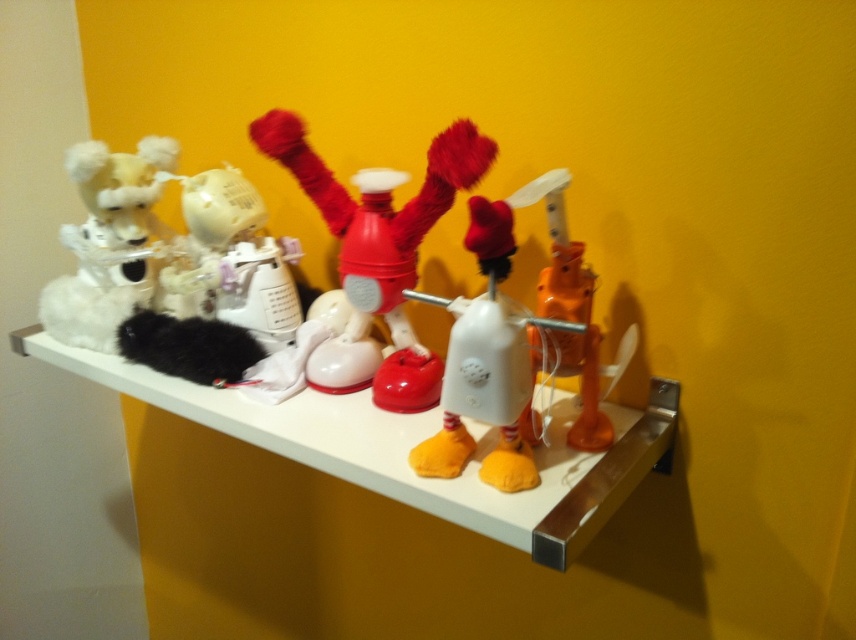
Question: Which of the following is the closest to the observer?

Choices:
 (A) (542, 285)
 (B) (414, 502)
 (C) (456, 460)
 (D) (123, 305)

Answer: (B)

Question: Which point is farther to the camera?

Choices:
 (A) (589, 280)
 (B) (407, 497)

Answer: (A)

Question: From the image, what is the correct spatial relationship of rubberized red robot at center in relation to black fluffy toy at center?

Choices:
 (A) above
 (B) below

Answer: (A)

Question: Can you confirm if rubberized red robot at center is positioned below fluffy white toy at left?

Choices:
 (A) no
 (B) yes

Answer: (B)

Question: Can you confirm if fluffy white toy at left is smaller than black fluffy toy at center?

Choices:
 (A) yes
 (B) no

Answer: (B)

Question: Which point is closer to the camera?

Choices:
 (A) white matte toy phone at center
 (B) orange matte robot at center
 (C) fluffy white toy at left

Answer: (A)